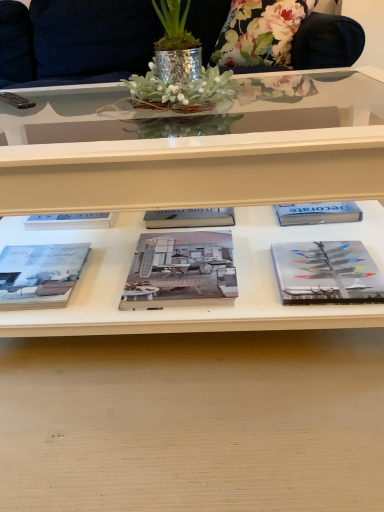
This screenshot has width=384, height=512. I want to click on free spot above matte gray book at center, which is counted as the second book, starting from the left (from a real-world perspective), so click(x=178, y=269).